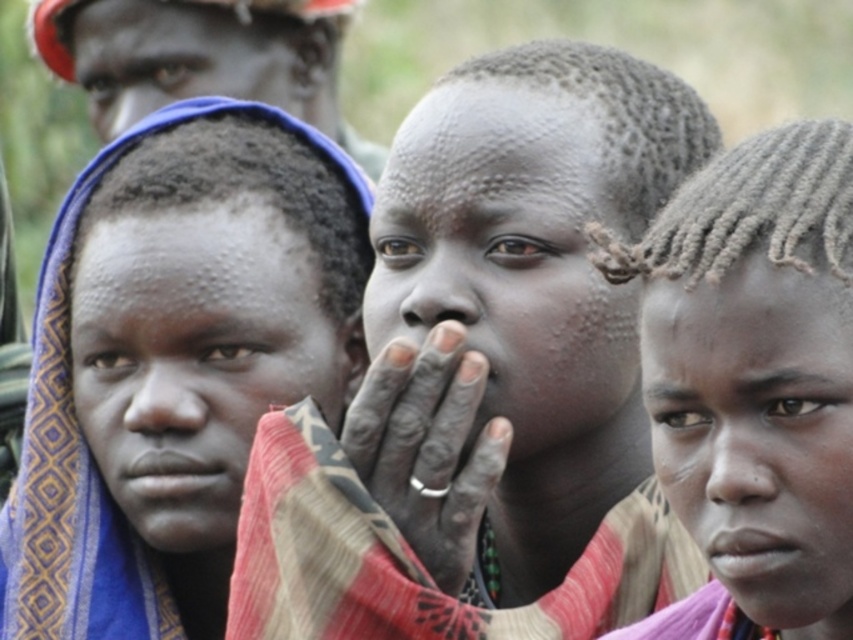
You are a photographer adjusting your camera settings to capture the scene. You notice the matte red helmet at upper left and the dark skin ring at center. Which object should you focus on first if you want to ensure both are in sharp focus?

The matte red helmet at upper left is above the dark skin ring at center, so focusing on the dark skin ring at center first will ensure both are in sharp focus since it is closer to the camera.

You are a photographer adjusting your camera settings. You have two points in your viewfinder labeled as point (202, 81) and point (436, 440). Which point is closer to your camera lens?

Point (202, 81) is further to the camera than point (436, 440), so the closer point to the camera lens is point (436, 440).

You are a photographer adjusting your camera settings to focus on the matte skin child at center. Given the coordinates provided, can you determine if the child is positioned centrally within the frame?

The matte skin child at center is located at point (486, 376), which is close to the center coordinates of (426, 320). Therefore, the child is positioned centrally within the frame.